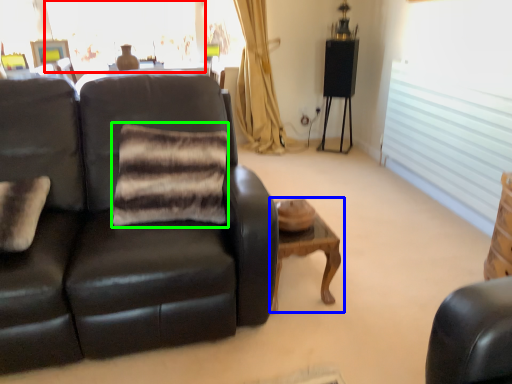
Question: Which is nearer to the window (highlighted by a red box)? table (highlighted by a blue box) or pillow (highlighted by a green box).

Choices:
 (A) table
 (B) pillow

Answer: (B)